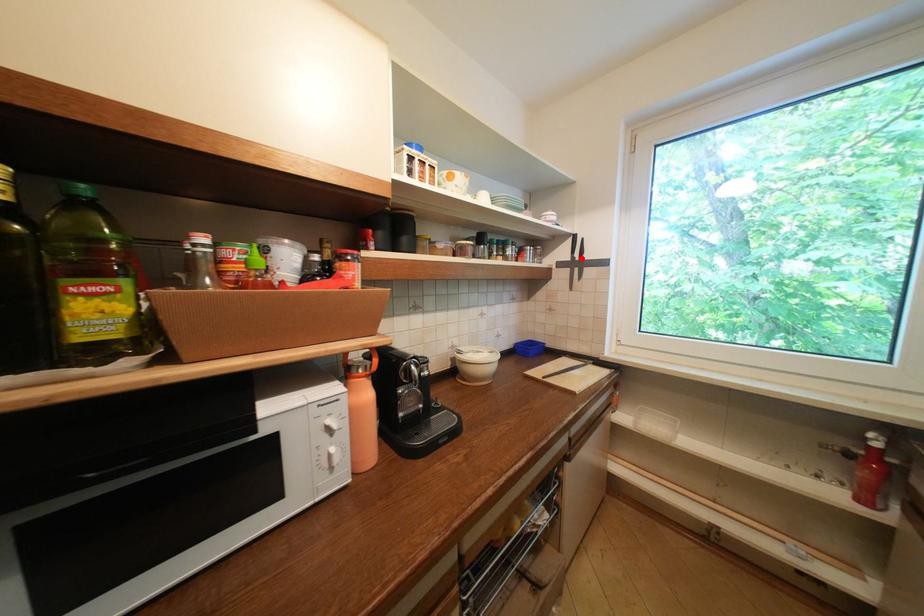
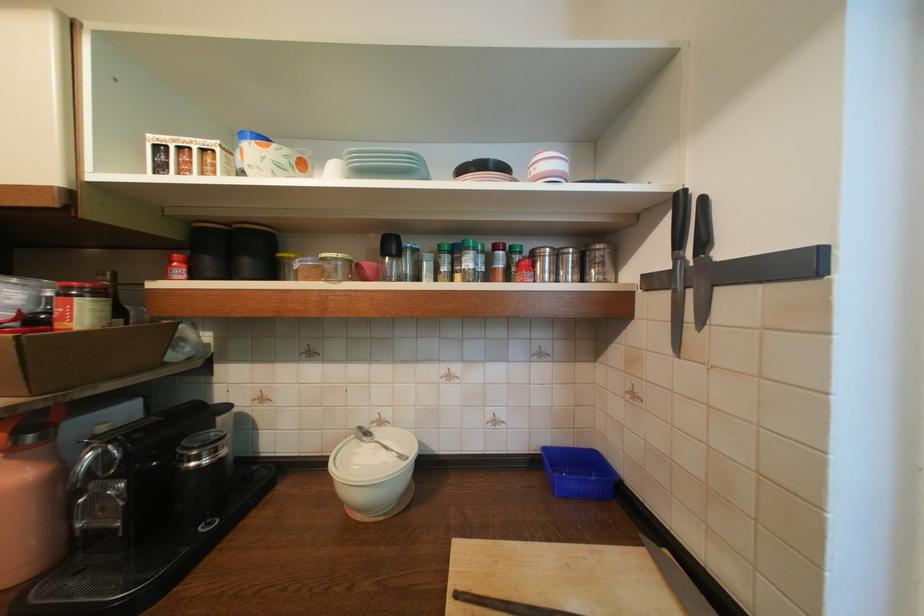
Find the pixel in the second image that matches the highlighted location in the first image.

(686, 261)